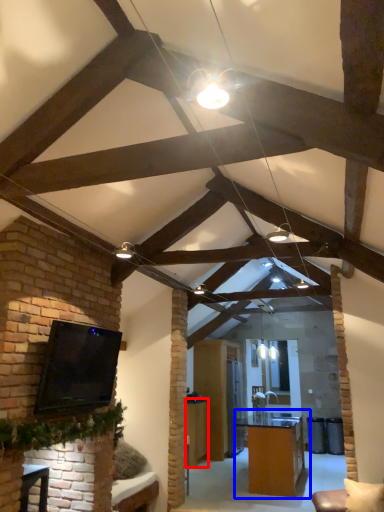
Question: Among these objects, which one is nearest to the camera, table (highlighted by a red box) or table (highlighted by a blue box)?

Choices:
 (A) table
 (B) table

Answer: (B)